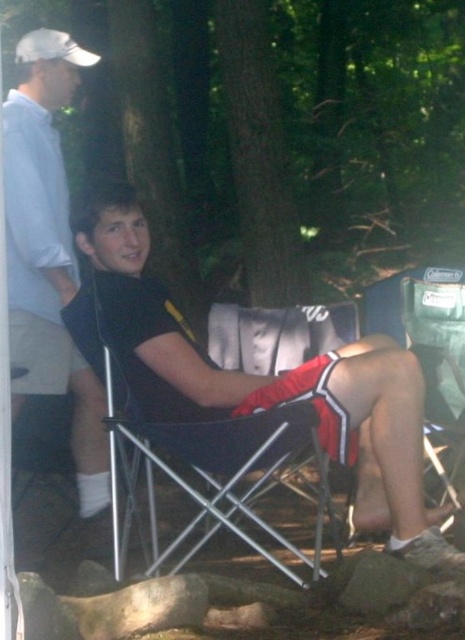
Question: Which of the following is the farthest from the observer?

Choices:
 (A) (414, 506)
 (B) (92, 500)
 (C) (248, 541)

Answer: (B)

Question: Is black fabric shorts at center behind black matte shirt at upper left?

Choices:
 (A) no
 (B) yes

Answer: (A)

Question: Which point appears farthest from the camera in this image?

Choices:
 (A) [177, 477]
 (B) [75, 268]
 (C) [414, 490]

Answer: (B)

Question: Can you confirm if black fabric shorts at center is positioned to the right of black fabric chair at center?

Choices:
 (A) no
 (B) yes

Answer: (B)

Question: Which point appears farthest from the camera in this image?

Choices:
 (A) (123, 360)
 (B) (203, 497)
 (C) (22, 83)

Answer: (C)

Question: Can you confirm if black matte shirt at upper left is bigger than black fabric chair at center?

Choices:
 (A) no
 (B) yes

Answer: (A)